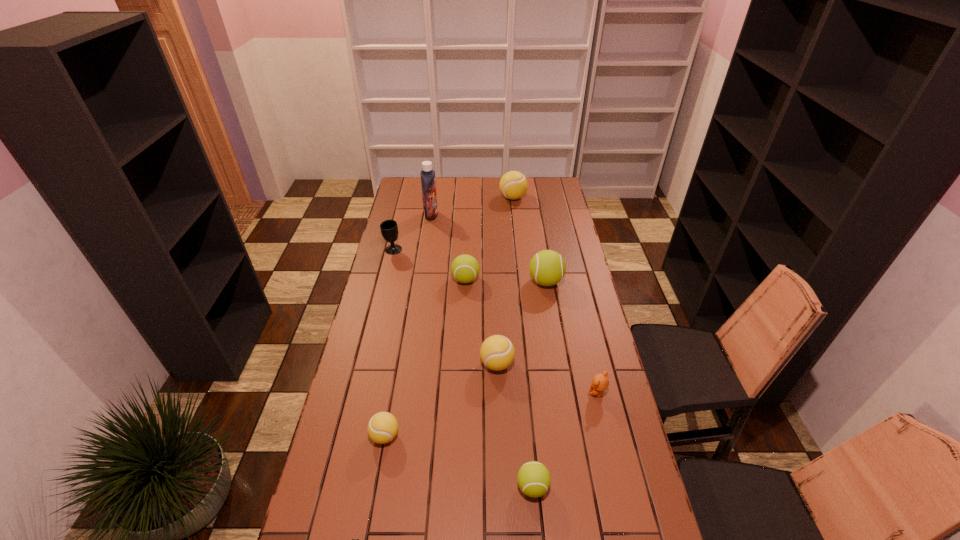
The height and width of the screenshot is (540, 960). I want to click on teddy bear, so click(600, 382).

In order to click on brown teddy bear in this screenshot , I will do `click(600, 382)`.

This screenshot has height=540, width=960. In order to click on the nearest yellow tennis ball in this screenshot , I will do click(382, 428).

Identify the location of the leftmost tennis ball. This screenshot has width=960, height=540. (382, 428).

Image resolution: width=960 pixels, height=540 pixels. Identify the location of the second green tennis ball from left to right. (533, 478).

This screenshot has width=960, height=540. I want to click on the nearest green tennis ball, so click(533, 478).

Where is `vacant space situated on the front label of the blue shampoo`? Image resolution: width=960 pixels, height=540 pixels. vacant space situated on the front label of the blue shampoo is located at coordinates (466, 215).

At what (x,y) coordinates should I click in order to perform the action: click on vacant space situated 0.240m on the left of the farthest object. Please return your answer as a coordinate pair (x, y). This screenshot has height=540, width=960. Looking at the image, I should click on (454, 198).

Find the location of a particular element. The width and height of the screenshot is (960, 540). vacant space situated 0.380m on the front of the rightmost green tennis ball is located at coordinates (561, 368).

Where is `free space located 0.180m on the right of the eighth nearest object`? The height and width of the screenshot is (540, 960). free space located 0.180m on the right of the eighth nearest object is located at coordinates [x=441, y=250].